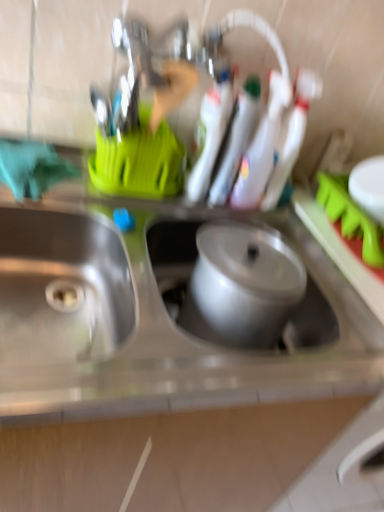
Question: Which is correct: stainless steel sink at left, arranged as the 1th sink when viewed from the left, is inside metallic silver pot at center, acting as the second sink starting from the left, or outside of it?

Choices:
 (A) inside
 (B) outside

Answer: (B)

Question: Is stainless steel sink at left, arranged as the 1th sink when viewed from the left, taller or shorter than metallic silver pot at center, which is the first sink from right to left?

Choices:
 (A) short
 (B) tall

Answer: (B)

Question: Considering the positions of stainless steel sink at left, arranged as the 1th sink when viewed from the left, and metallic silver pot at center, which is the first sink from right to left, in the image, is stainless steel sink at left, arranged as the 1th sink when viewed from the left, wider or thinner than metallic silver pot at center, which is the first sink from right to left,?

Choices:
 (A) thin
 (B) wide

Answer: (B)

Question: Visually, is metallic silver pot at center, acting as the second sink starting from the left, positioned to the left or to the right of stainless steel sink at left, the second sink in the right-to-left sequence?

Choices:
 (A) left
 (B) right

Answer: (B)

Question: Relative to stainless steel sink at left, arranged as the 1th sink when viewed from the left, is metallic silver pot at center, acting as the second sink starting from the left, in front or behind?

Choices:
 (A) behind
 (B) front

Answer: (A)

Question: Considering the positions of metallic silver pot at center, which is the first sink from right to left, and stainless steel sink at left, arranged as the 1th sink when viewed from the left, in the image, is metallic silver pot at center, which is the first sink from right to left, bigger or smaller than stainless steel sink at left, arranged as the 1th sink when viewed from the left,?

Choices:
 (A) big
 (B) small

Answer: (B)

Question: From their relative heights in the image, would you say metallic silver pot at center, which is the first sink from right to left, is taller or shorter than stainless steel sink at left, arranged as the 1th sink when viewed from the left?

Choices:
 (A) tall
 (B) short

Answer: (B)